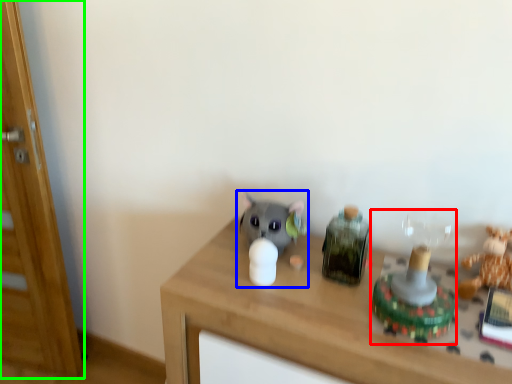
Question: Based on their relative distances, which object is farther from toy (highlighted by a red box)? Choose from toy (highlighted by a blue box) and glass door (highlighted by a green box).

Choices:
 (A) toy
 (B) glass door

Answer: (B)